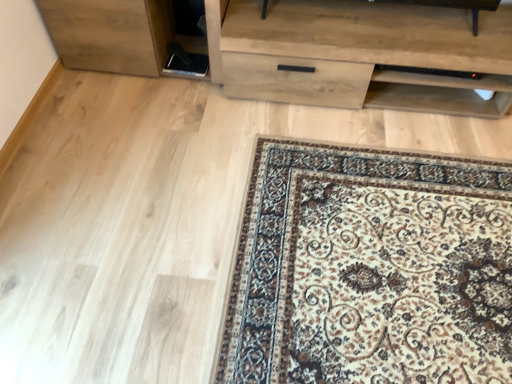
Question: Should I look upward or downward to see light wood/texture chest of drawers at upper center?

Choices:
 (A) down
 (B) up

Answer: (B)